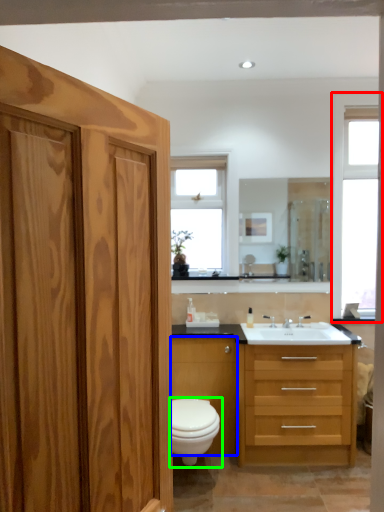
Question: Based on their relative distances, which object is farther from window (highlighted by a red box)? Choose from cabinetry (highlighted by a blue box) and toilet (highlighted by a green box).

Choices:
 (A) cabinetry
 (B) toilet

Answer: (B)